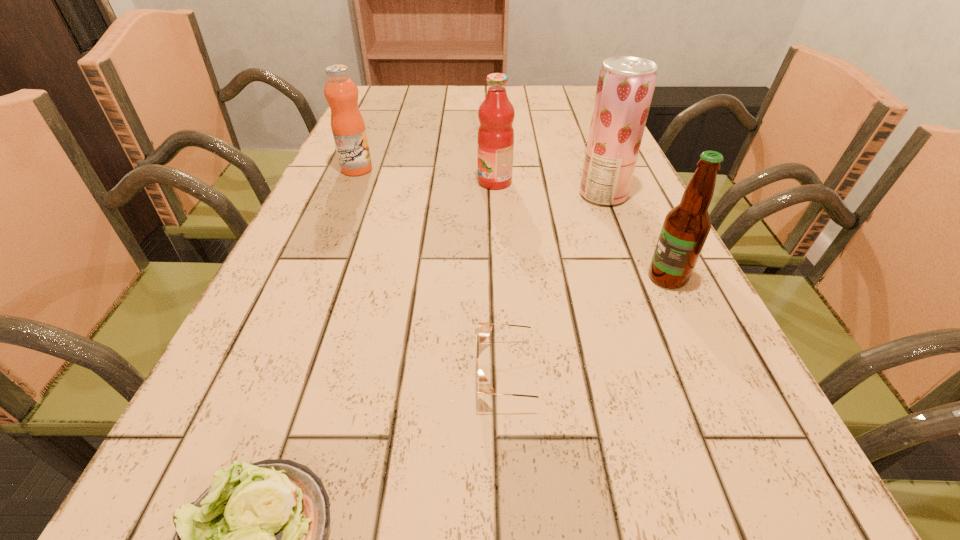
The width and height of the screenshot is (960, 540). I want to click on the rightmost fruit juice, so click(x=625, y=87).

In order to click on the second fruit juice from right to left in this screenshot , I will do `click(496, 113)`.

This screenshot has width=960, height=540. I want to click on beer bottle, so click(x=686, y=227).

Where is `the leftmost fruit juice`? the leftmost fruit juice is located at coordinates (347, 124).

The height and width of the screenshot is (540, 960). I want to click on the fifth farthest object, so click(x=485, y=328).

Where is `vacant space located 0.080m on the back of the rightmost fruit juice`? This screenshot has height=540, width=960. vacant space located 0.080m on the back of the rightmost fruit juice is located at coordinates (592, 166).

Image resolution: width=960 pixels, height=540 pixels. Find the location of `blank area located on the front label of the second fruit juice from right to left`. blank area located on the front label of the second fruit juice from right to left is located at coordinates (410, 182).

Find the location of `free space located on the front label of the second fruit juice from right to left`. free space located on the front label of the second fruit juice from right to left is located at coordinates (359, 182).

The height and width of the screenshot is (540, 960). I want to click on free space located on the front label of the second fruit juice from right to left, so click(x=427, y=182).

The height and width of the screenshot is (540, 960). I want to click on vacant region located 0.380m on the label of the fourth farthest object, so click(437, 278).